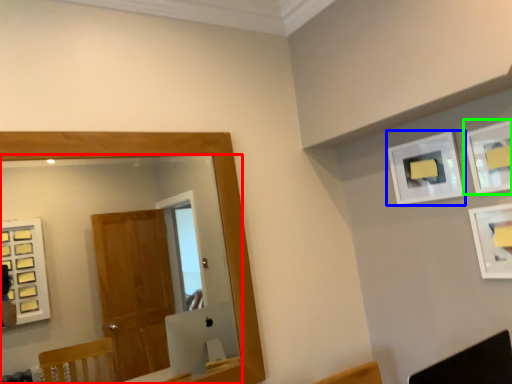
Question: Which object is positioned closest to mirror (highlighted by a red box)? Select from picture frame (highlighted by a blue box) and picture frame (highlighted by a green box).

Choices:
 (A) picture frame
 (B) picture frame

Answer: (A)